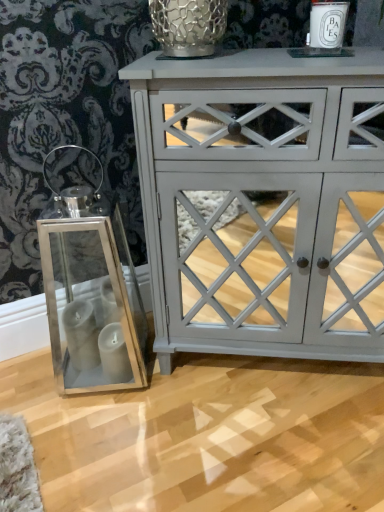
At what (x,y) coordinates should I click in order to perform the action: click on free space to the right of white ceramic candle at upper right. Please return your answer as a coordinate pair (x, y). This screenshot has height=512, width=384. Looking at the image, I should click on (365, 55).